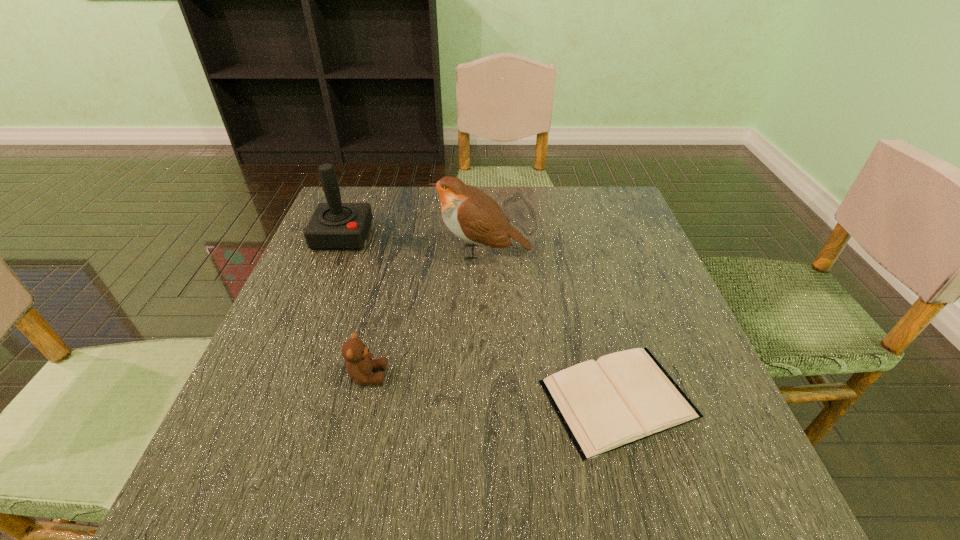
Find the location of a particular element. vacant space at the right edge of the desktop is located at coordinates (636, 308).

In the image, there is a desktop. At what (x,y) coordinates should I click in order to perform the action: click on vacant space at the far left corner. Please return your answer as a coordinate pair (x, y). This screenshot has width=960, height=540. Looking at the image, I should click on (374, 197).

Image resolution: width=960 pixels, height=540 pixels. What are the coordinates of `vacant region at the far right corner of the desktop` in the screenshot? It's located at (596, 221).

This screenshot has height=540, width=960. Identify the location of vacant region at the near right corner of the desktop. (727, 475).

You are a GUI agent. You are given a task and a screenshot of the screen. Output one action in this format:
    pyautogui.click(x=<x>, y=<y>)
    Task: Click on the free spot between the teddy bear and the hardback book
    
    Given the screenshot: What is the action you would take?
    pyautogui.click(x=492, y=387)

Locate an element on the screen. vacant area that lies between the bird and the third tallest object is located at coordinates (425, 314).

At what (x,y) coordinates should I click in order to perform the action: click on free spot between the shortest object and the bird. Please return your answer as a coordinate pair (x, y). Looking at the image, I should click on (550, 326).

This screenshot has height=540, width=960. Find the location of `vacant region between the second shortest object and the bird`. vacant region between the second shortest object and the bird is located at coordinates (425, 314).

The height and width of the screenshot is (540, 960). Find the location of `vacant area that lies between the second object from left to right and the shortest object`. vacant area that lies between the second object from left to right and the shortest object is located at coordinates (492, 387).

Find the location of a particular element. empty space between the second shortest object and the bird is located at coordinates (425, 314).